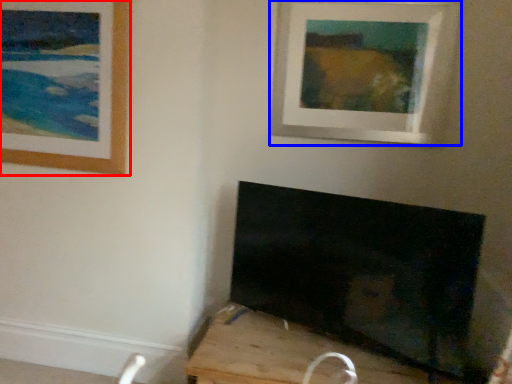
Question: Which object is further to the camera taking this photo, picture frame (highlighted by a red box) or picture frame (highlighted by a blue box)?

Choices:
 (A) picture frame
 (B) picture frame

Answer: (B)